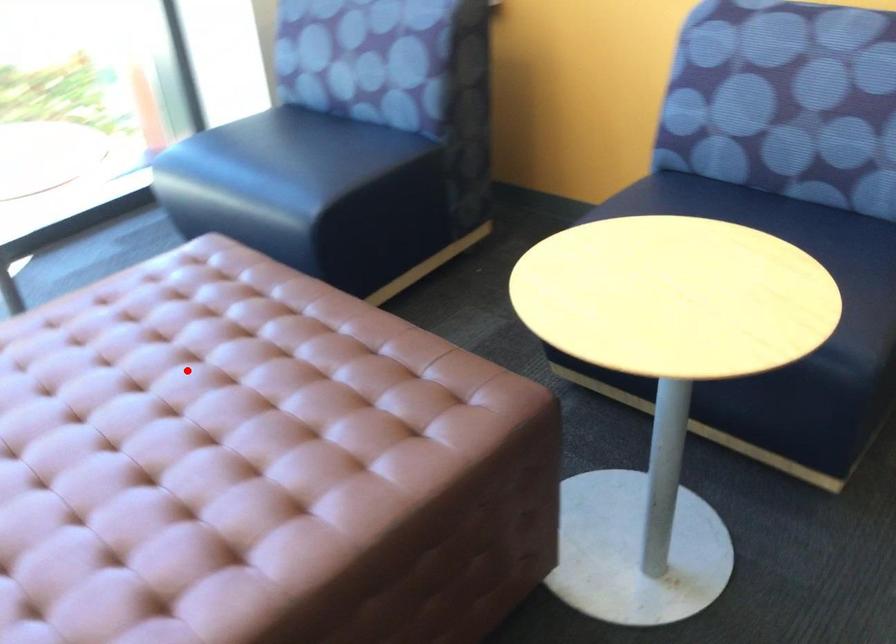
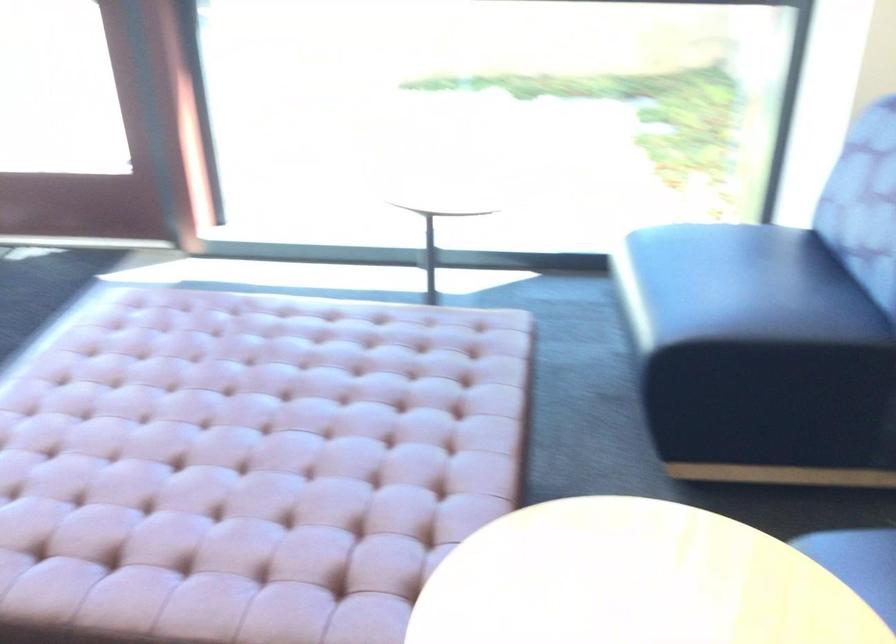
In the second image, find the point that corresponds to the highlighted location in the first image.

(306, 406)